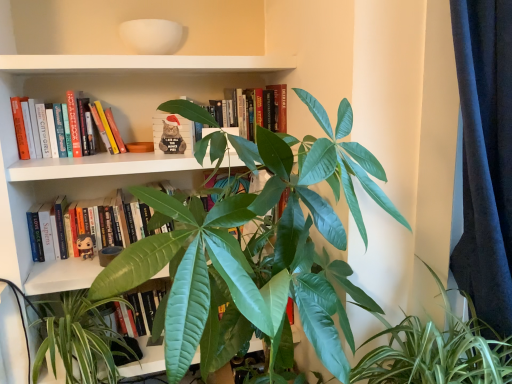
Question: Is santa hat plush cat at center, the 3th book when ordered from top to bottom, at the right side of hardcover book at center, positioned as the 4th book in bottom-to-top order?

Choices:
 (A) no
 (B) yes

Answer: (A)

Question: Does santa hat plush cat at center, the second book from the bottom, have a greater height compared to hardcover book at center, positioned as the 4th book in bottom-to-top order?

Choices:
 (A) yes
 (B) no

Answer: (B)

Question: Can you confirm if santa hat plush cat at center, the second book from the bottom, is shorter than hardcover book at center, positioned as the 4th book in bottom-to-top order?

Choices:
 (A) yes
 (B) no

Answer: (A)

Question: Is santa hat plush cat at center, the 3th book when ordered from top to bottom, oriented towards hardcover book at center, the first book from the top?

Choices:
 (A) yes
 (B) no

Answer: (B)

Question: Is santa hat plush cat at center, the second book from the bottom, at the left side of hardcover book at center, the first book from the top?

Choices:
 (A) no
 (B) yes

Answer: (B)

Question: Is santa hat plush cat at center, the 3th book when ordered from top to bottom, located outside hardcover book at center, the first book from the top?

Choices:
 (A) no
 (B) yes

Answer: (B)

Question: Can santa hat plush cat at center, the 3th book when ordered from top to bottom, be found inside green glossy leaf at lower center?

Choices:
 (A) yes
 (B) no

Answer: (B)

Question: Could you tell me if green glossy leaf at lower center is facing santa hat plush cat at center, the second book from the bottom?

Choices:
 (A) no
 (B) yes

Answer: (A)

Question: Is green glossy leaf at lower center oriented away from santa hat plush cat at center, the second book from the bottom?

Choices:
 (A) no
 (B) yes

Answer: (A)

Question: From a real-world perspective, is green glossy leaf at lower center below santa hat plush cat at center, the second book from the bottom?

Choices:
 (A) yes
 (B) no

Answer: (A)

Question: Is the position of green glossy leaf at lower center more distant than that of santa hat plush cat at center, the second book from the bottom?

Choices:
 (A) yes
 (B) no

Answer: (B)

Question: Is green glossy leaf at lower center far from santa hat plush cat at center, the second book from the bottom?

Choices:
 (A) yes
 (B) no

Answer: (B)

Question: Is hardcover book at center, the 1th book in the bottom-to-top sequence, next to green glossy leaf at lower center and touching it?

Choices:
 (A) no
 (B) yes

Answer: (A)